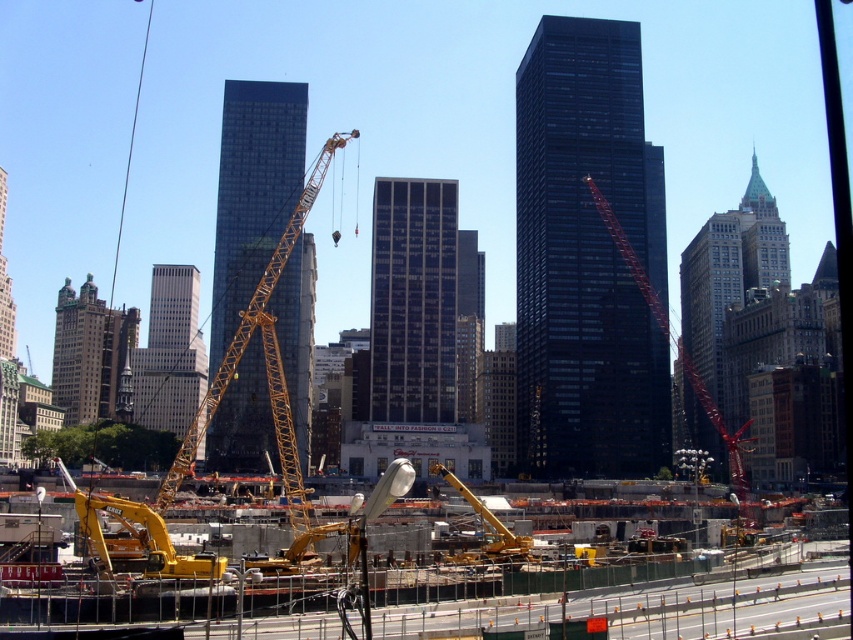
Question: Is yellow metallic excavator at lower center to the left of yellow metallic crane at center from the viewer's perspective?

Choices:
 (A) no
 (B) yes

Answer: (B)

Question: Where is yellow metallic excavator at lower center located in relation to yellow metallic crane at center in the image?

Choices:
 (A) right
 (B) left

Answer: (B)

Question: Is yellow metallic excavator at lower center to the right of yellow metallic crane at center from the viewer's perspective?

Choices:
 (A) yes
 (B) no

Answer: (B)

Question: Which point appears closest to the camera in this image?

Choices:
 (A) (666, 332)
 (B) (474, 593)

Answer: (B)

Question: Which point is farther from the camera taking this photo?

Choices:
 (A) (682, 611)
 (B) (701, 388)

Answer: (B)